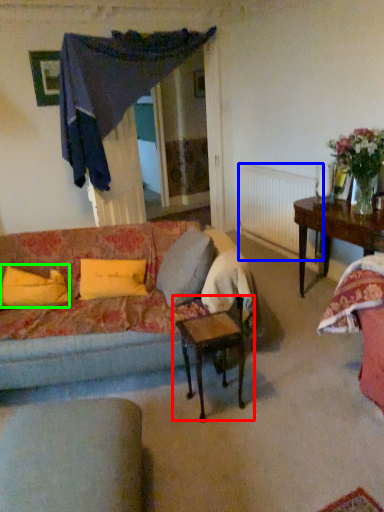
Question: Which object is positioned closest to table (highlighted by a red box)? Select from radiator (highlighted by a blue box) and pillow (highlighted by a green box).

Choices:
 (A) radiator
 (B) pillow

Answer: (B)